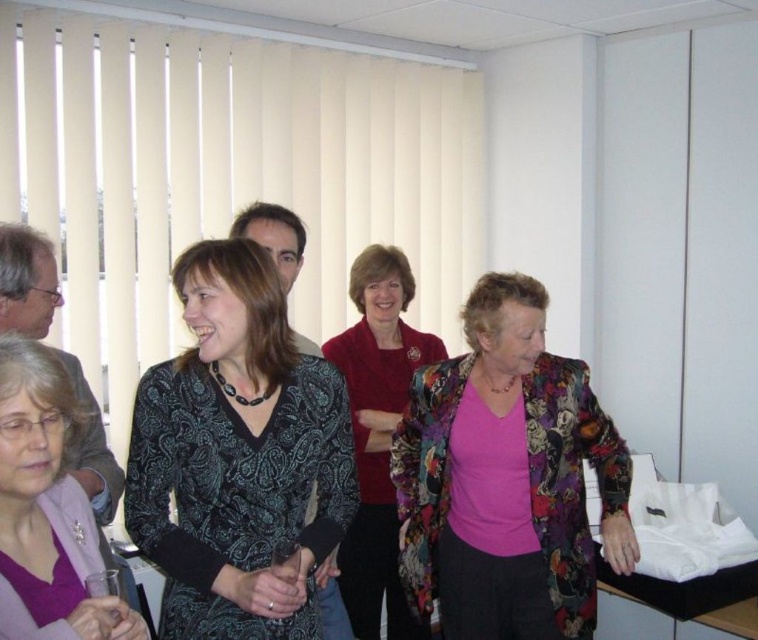
Which of these two, black paisley dress at center or patterned fabric dress at center, stands taller?

patterned fabric dress at center is taller.

The width and height of the screenshot is (758, 640). What do you see at coordinates (236, 454) in the screenshot?
I see `black paisley dress at center` at bounding box center [236, 454].

At what (x,y) coordinates should I click in order to perform the action: click on black paisley dress at center. Please return your answer as a coordinate pair (x, y). Looking at the image, I should click on (236, 454).

Can you confirm if black paisley dress at center is positioned below matte black dress at center?

Actually, black paisley dress at center is above matte black dress at center.

Is point (196, 394) positioned before point (80, 497)?

That is False.

Identify the location of black paisley dress at center. The height and width of the screenshot is (640, 758). (236, 454).

Who is shorter, floral-patterned jacket at center or matte red sweater at center?

floral-patterned jacket at center is shorter.

Which is above, floral-patterned jacket at center or matte red sweater at center?

floral-patterned jacket at center is higher up.

Who is more distant from viewer, (572,627) or (381,285)?

The point (381,285) is more distant.

Find the location of a particular element. This screenshot has height=640, width=758. floral-patterned jacket at center is located at coordinates (506, 477).